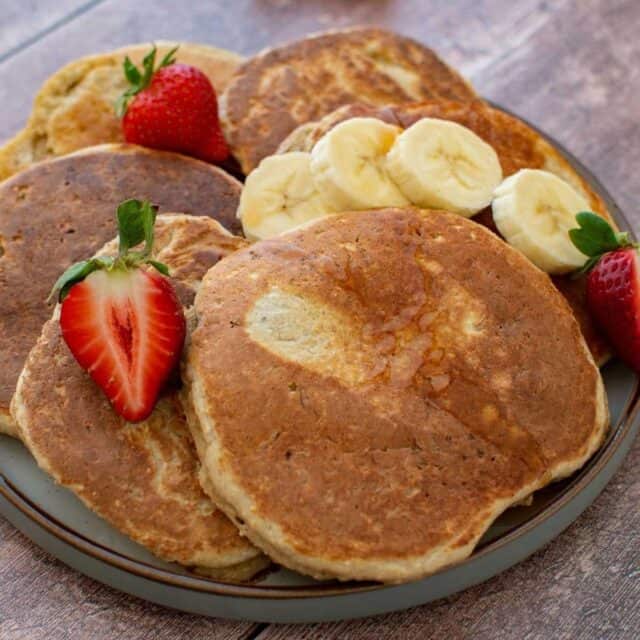
Identify the location of empty space on table. (16, 602).